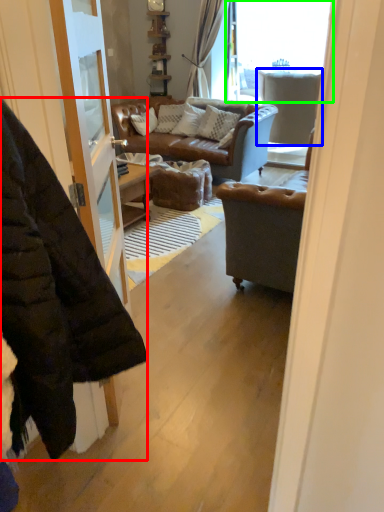
Question: Which object is the farthest from jacket (highlighted by a red box)? Choose among these: armchair (highlighted by a blue box) or window (highlighted by a green box).

Choices:
 (A) armchair
 (B) window

Answer: (B)